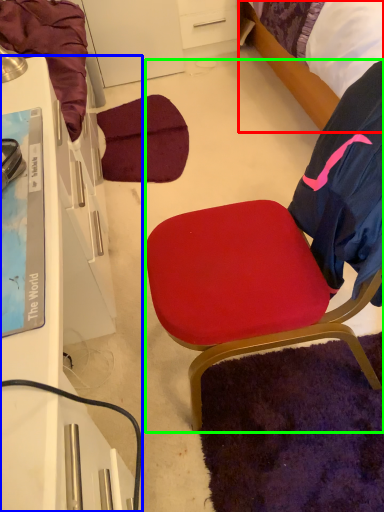
Question: Considering the real-world distances, which object is farthest from bed (highlighted by a red box)? desk (highlighted by a blue box) or chair (highlighted by a green box)?

Choices:
 (A) desk
 (B) chair

Answer: (A)